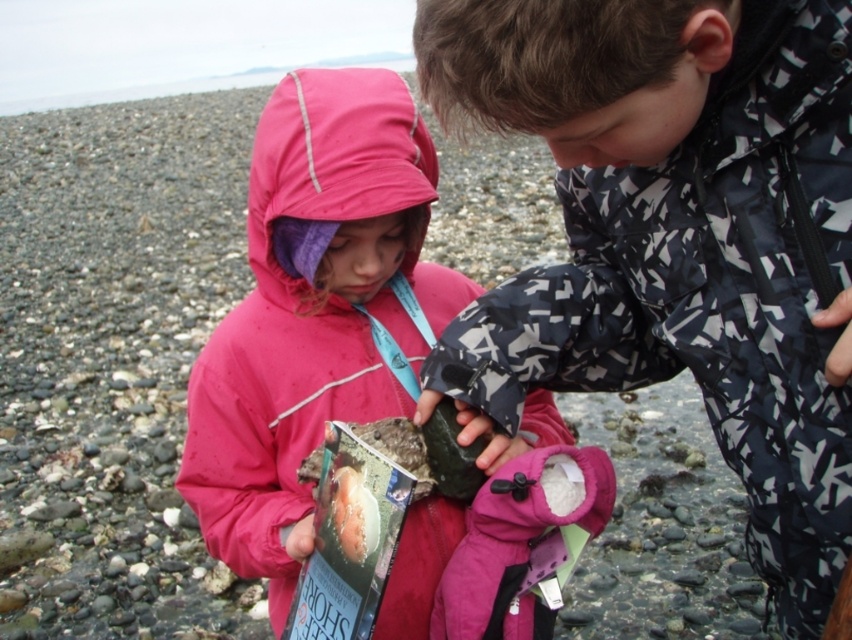
Can you confirm if camouflage-patterned jacket at center is thinner than pink fleece jacket at center?

Indeed, camouflage-patterned jacket at center has a lesser width compared to pink fleece jacket at center.

Is camouflage-patterned jacket at center shorter than pink fleece jacket at center?

Yes, camouflage-patterned jacket at center is shorter than pink fleece jacket at center.

Image resolution: width=852 pixels, height=640 pixels. I want to click on camouflage-patterned jacket at center, so click(x=676, y=236).

The height and width of the screenshot is (640, 852). Identify the location of camouflage-patterned jacket at center. (676, 236).